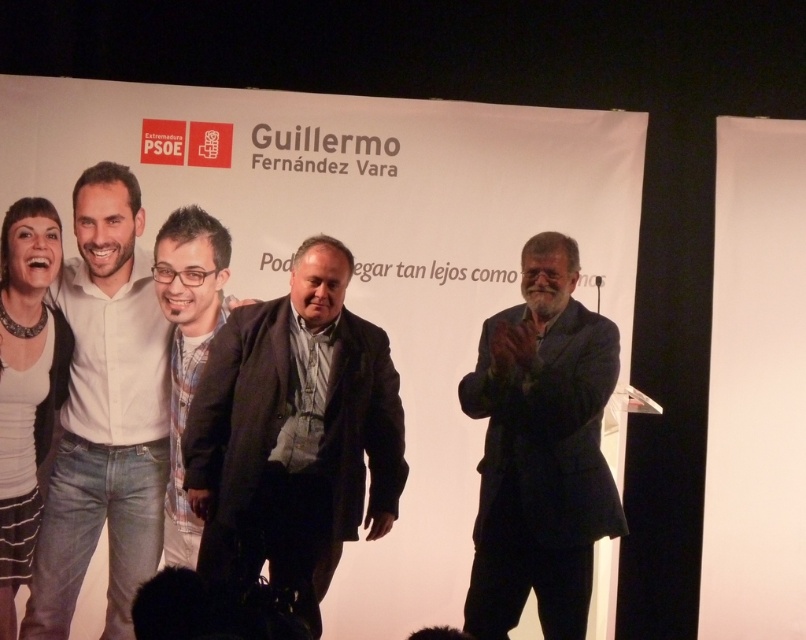
You are a photographer standing behind the group on the stage. You want to take a photo of the white shirt at left and the matte black jacket at center. If your camera can only focus on objects within 10 inches of each other, will both subjects be in focus?

The distance between the white shirt at left and matte black jacket at center is 9.83 inches, which is within the 10 inch focus range. Therefore, both subjects will be in focus.